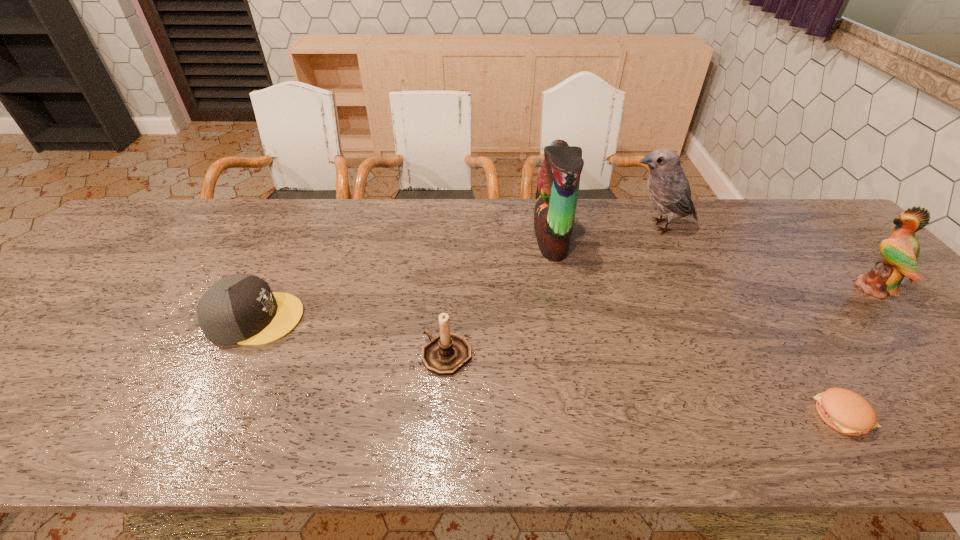
Choose which parrot is the nearest neighbor to the fourth object from right to left. Please provide its 2D coordinates. Your answer should be formatted as a tuple, i.e. [(x, y)], where the tuple contains the x and y coordinates of a point satisfying the conditions above.

[(668, 188)]

Identify which parrot is the second nearest to the leftmost object. Please provide its 2D coordinates. Your answer should be formatted as a tuple, i.e. [(x, y)], where the tuple contains the x and y coordinates of a point satisfying the conditions above.

[(668, 188)]

Where is `free space that satisfies the following two spatial constraints: 1. on the front-facing side of the patty; 2. on the left side of the third object from right to left`? This screenshot has height=540, width=960. free space that satisfies the following two spatial constraints: 1. on the front-facing side of the patty; 2. on the left side of the third object from right to left is located at coordinates (752, 415).

I want to click on blank space that satisfies the following two spatial constraints: 1. on the back side of the second object from right to left; 2. on the front-facing side of the leftmost object, so (778, 318).

At what (x,y) coordinates should I click in order to perform the action: click on free point that satisfies the following two spatial constraints: 1. on the front-facing side of the leftmost object; 2. on the back side of the nearest object. Please return your answer as a coordinate pair (x, y). This screenshot has width=960, height=540. Looking at the image, I should click on (207, 415).

You are a GUI agent. You are given a task and a screenshot of the screen. Output one action in this format:
    pyautogui.click(x=<x>, y=<y>)
    Task: Click on the vacant point that satisfies the following two spatial constraints: 1. at the face of the leftmost parrot; 2. on the back side of the patty
    This screenshot has height=540, width=960.
    Given the screenshot: What is the action you would take?
    pyautogui.click(x=584, y=415)

The image size is (960, 540). I want to click on free space in the image that satisfies the following two spatial constraints: 1. on the front-facing side of the leftmost object; 2. on the right side of the shortest object, so click(x=207, y=415).